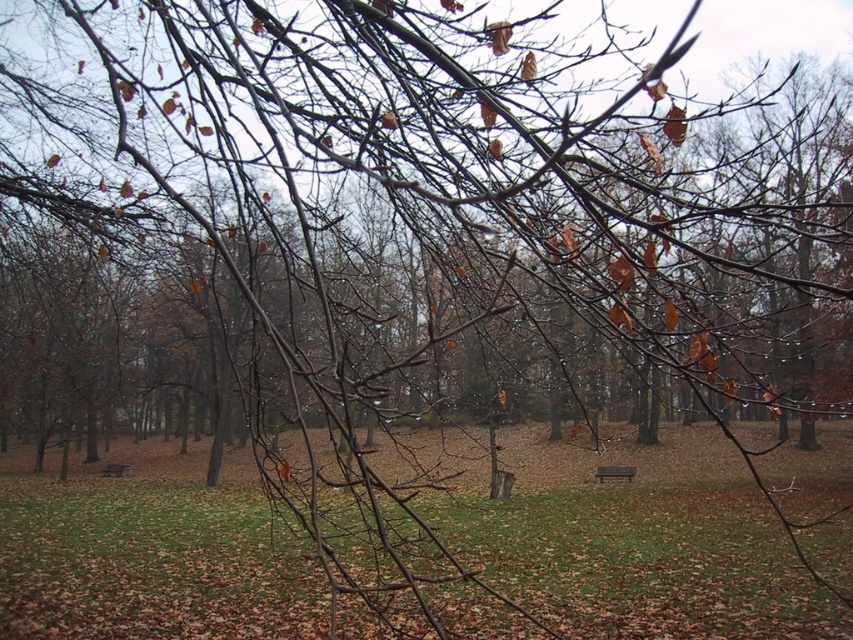
Based on the photo, you are standing at the entrance of the park and want to sit on the brown wooden bench at center. Based on the coordinates provided, in which general direction should you walk to reach the bench?

The brown wooden bench at center is located at coordinates point (614, 472), which suggests it is positioned towards the lower right of the image. Therefore, you should walk towards the lower right direction to reach the bench.